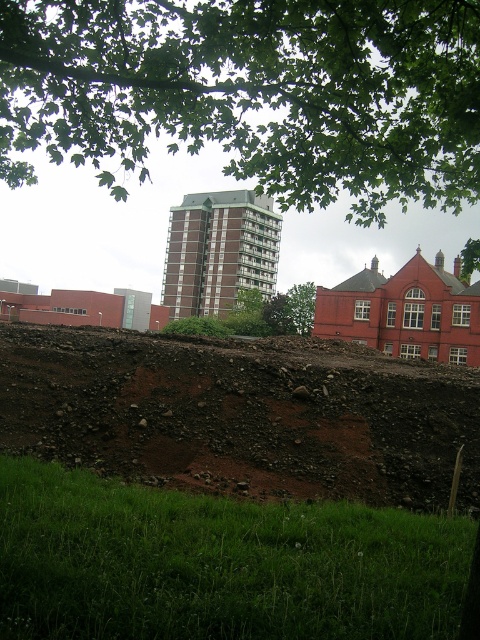
You are a city planner analyzing the urban landscape. You notice two green leafy trees in the scene. Which tree, the green leafy tree at upper center or the green leafy tree at center, would cast a larger shadow during midday when the sun is directly overhead?

The green leafy tree at upper center is bigger than the green leafy tree at center, so it would cast a larger shadow during midday when the sun is directly overhead.

You are standing at the base of the green leafy tree at upper center and want to take a photo of it with a camera that has a maximum focus range of 6 meters. Will the camera be able to focus on the tree?

The distance of green leafy tree at upper center from camera is 5.93 meters, which is within the camera maximum focus range of 6 meters. Therefore, the camera can focus on the green leafy tree at upper center.